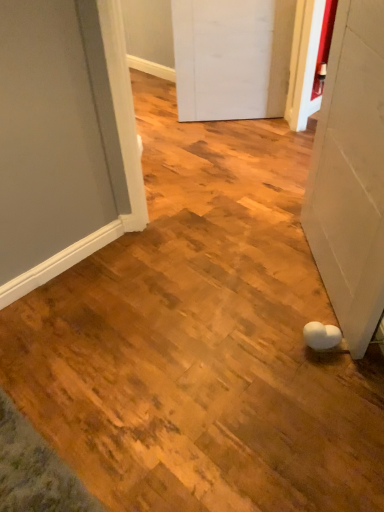
You are a GUI agent. You are given a task and a screenshot of the screen. Output one action in this format:
    pyautogui.click(x=<x>, y=<y>)
    Task: Click on the vacant area that is in front of white matte door at lower right, which is the second door from top to bottom
    This screenshot has width=384, height=512.
    Given the screenshot: What is the action you would take?
    pyautogui.click(x=312, y=387)